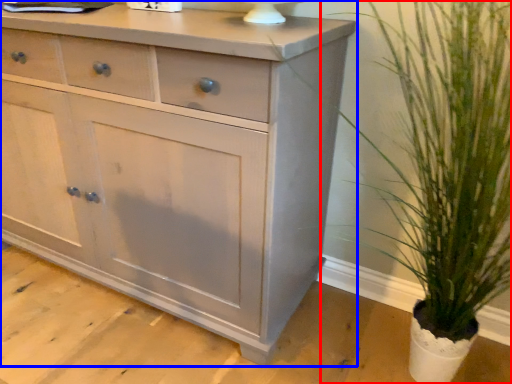
Question: Which object appears farthest to the camera in this image, houseplant (highlighted by a red box) or chest of drawers (highlighted by a blue box)?

Choices:
 (A) houseplant
 (B) chest of drawers

Answer: (B)